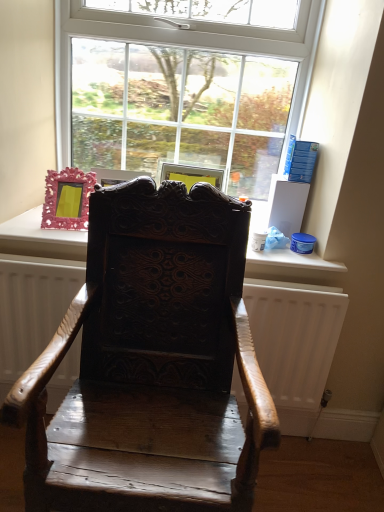
Question: Is the surface of clear glass window at upper center in direct contact with dark wood carved chair at center?

Choices:
 (A) no
 (B) yes

Answer: (A)

Question: Is clear glass window at upper center in front of dark wood carved chair at center?

Choices:
 (A) yes
 (B) no

Answer: (B)

Question: Does clear glass window at upper center have a lesser width compared to dark wood carved chair at center?

Choices:
 (A) no
 (B) yes

Answer: (B)

Question: Can you confirm if clear glass window at upper center is wider than dark wood carved chair at center?

Choices:
 (A) no
 (B) yes

Answer: (A)

Question: From the image's perspective, does clear glass window at upper center appear lower than dark wood carved chair at center?

Choices:
 (A) no
 (B) yes

Answer: (A)

Question: Choose the correct answer: Is dark wood carved chair at center inside wooden radiator at center or outside it?

Choices:
 (A) inside
 (B) outside

Answer: (B)

Question: Considering their positions, is dark wood carved chair at center located in front of or behind wooden radiator at center?

Choices:
 (A) behind
 (B) front

Answer: (B)

Question: Does point (43, 457) appear closer or farther from the camera than point (274, 399)?

Choices:
 (A) closer
 (B) farther

Answer: (A)

Question: From a real-world perspective, is dark wood carved chair at center physically located above or below wooden radiator at center?

Choices:
 (A) above
 (B) below

Answer: (A)

Question: Is pink plastic picture frame at upper left taller or shorter than wooden radiator at center?

Choices:
 (A) tall
 (B) short

Answer: (B)

Question: Which is correct: pink plastic picture frame at upper left is inside wooden radiator at center, or outside of it?

Choices:
 (A) outside
 (B) inside

Answer: (A)

Question: Would you say pink plastic picture frame at upper left is to the left or to the right of wooden radiator at center in the picture?

Choices:
 (A) right
 (B) left

Answer: (B)

Question: From a real-world perspective, is pink plastic picture frame at upper left above or below wooden radiator at center?

Choices:
 (A) below
 (B) above

Answer: (B)

Question: Considering the positions of point (23, 258) and point (51, 194), is point (23, 258) closer or farther from the camera than point (51, 194)?

Choices:
 (A) farther
 (B) closer

Answer: (B)

Question: From their relative heights in the image, would you say wooden radiator at center is taller or shorter than pink plastic picture frame at upper left?

Choices:
 (A) tall
 (B) short

Answer: (A)